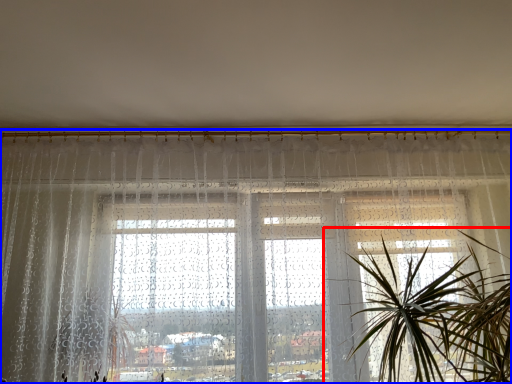
Question: Which object is closer to the camera taking this photo, houseplant (highlighted by a red box) or window (highlighted by a blue box)?

Choices:
 (A) houseplant
 (B) window

Answer: (A)